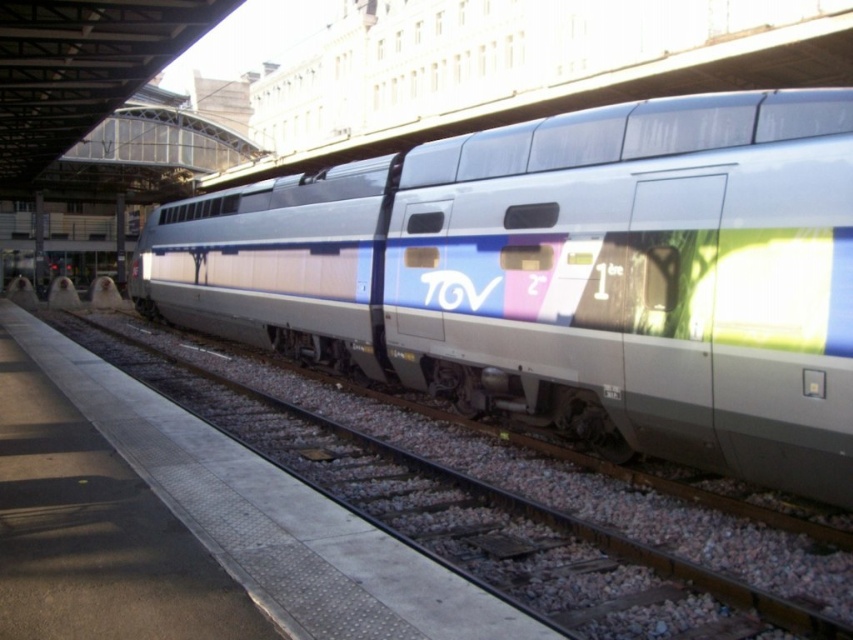
Is point (834, 289) closer to camera compared to point (432, 509)?

Yes, point (834, 289) is closer to viewer.

This screenshot has height=640, width=853. What do you see at coordinates (566, 276) in the screenshot?
I see `silver metallic train at center` at bounding box center [566, 276].

The image size is (853, 640). Describe the element at coordinates (566, 276) in the screenshot. I see `silver metallic train at center` at that location.

At what (x,y) coordinates should I click in order to perform the action: click on silver metallic train at center. Please return your answer as a coordinate pair (x, y). This screenshot has height=640, width=853. Looking at the image, I should click on (566, 276).